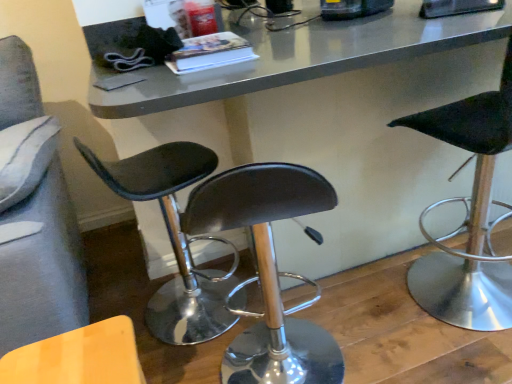
The image size is (512, 384). Find the location of `vacant area situated to the left side of black leather stool at right, the third chair from the left`. vacant area situated to the left side of black leather stool at right, the third chair from the left is located at coordinates (367, 308).